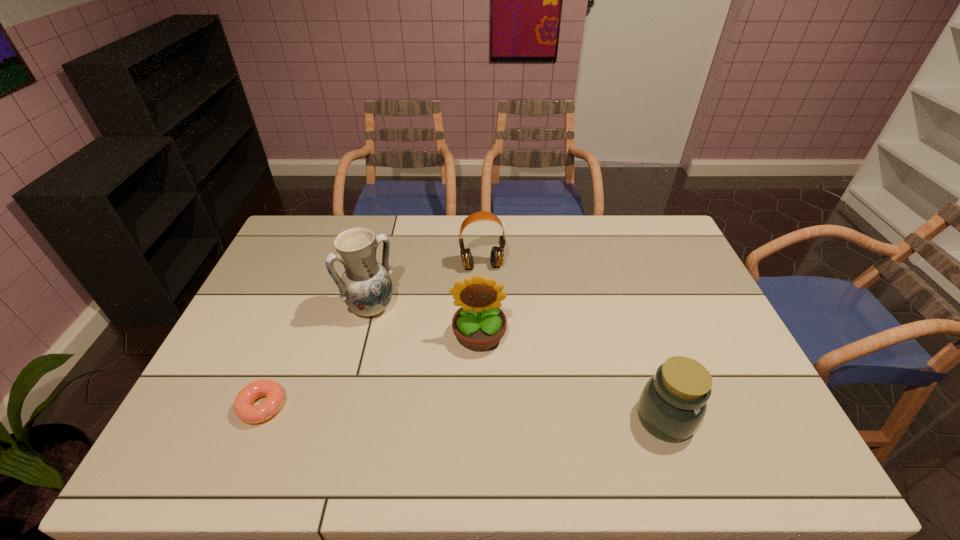
The image size is (960, 540). I want to click on vacant spot on the desktop that is between the shortest object and the rightmost object and is positioned on either side of the pottery, so click(x=467, y=412).

In order to click on free space on the desktop that is between the doughnut and the jar and is positioned on the face of the sunflower in this screenshot , I will do `click(481, 413)`.

Locate an element on the screen. vacant space on the desktop that is between the leftmost object and the jar and is positioned on the ear cups of the headset is located at coordinates (510, 414).